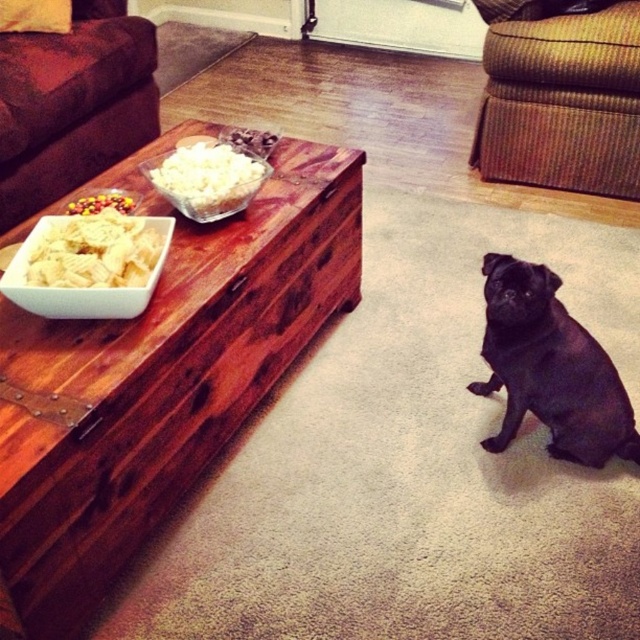
Question: Is black matte dog at lower right above shiny metallic nuts at left?

Choices:
 (A) yes
 (B) no

Answer: (B)

Question: Can you confirm if brown textured couch at upper right is smaller than white popcorn at center?

Choices:
 (A) no
 (B) yes

Answer: (A)

Question: Does white crispy chips at left appear under white popcorn at center?

Choices:
 (A) no
 (B) yes

Answer: (B)

Question: Which point is farther from the camera taking this photo?

Choices:
 (A) (516, 49)
 (B) (131, 253)
 (C) (230, 202)

Answer: (A)

Question: Among these objects, which one is farthest from the camera?

Choices:
 (A) shiny metallic nuts at left
 (B) white crispy chips at left
 (C) brown fabric couch at upper left

Answer: (C)

Question: Which point is closer to the camera taking this photo?

Choices:
 (A) (250, 188)
 (B) (636, 449)

Answer: (A)